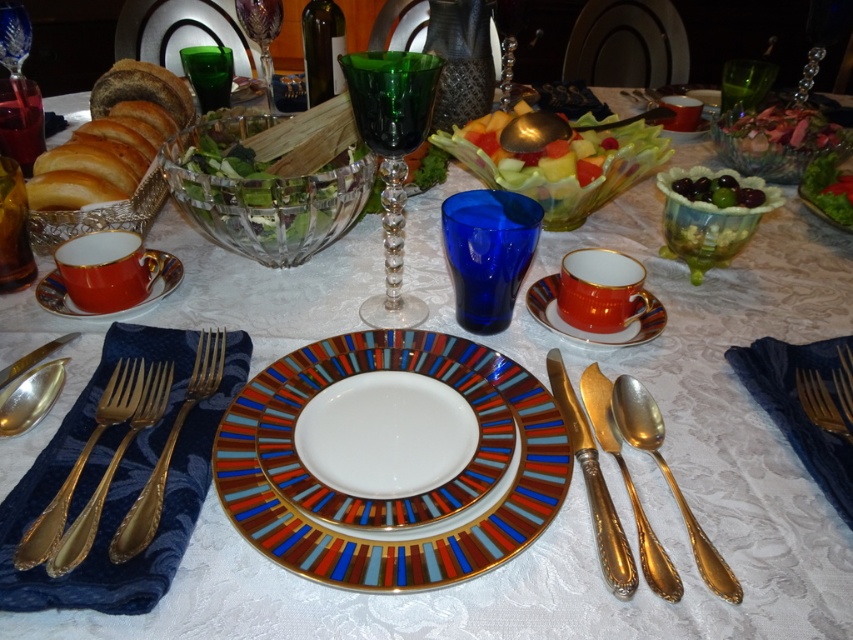
From the picture: What object is located at the coordinates point [392,157]?

The green crystal wine glass at center is located at the coordinates point [392,157].

You are a guest at this formal dinner and need to place your napkin on the table. According to the image, where should you place it so it doesn,t interfere with the green crystal wine glass at center?

The green crystal wine glass at center is located at point (392, 157), so you should place your napkin away from that coordinate to avoid interference.

You are a guest at the table and want to place your napkin on the translucent plastic salad at center. Can you confirm if the point at coordinates (560, 163) is on the translucent plastic salad at center?

Yes, the point at coordinates (560, 163) is on the translucent plastic salad at center according to the description.